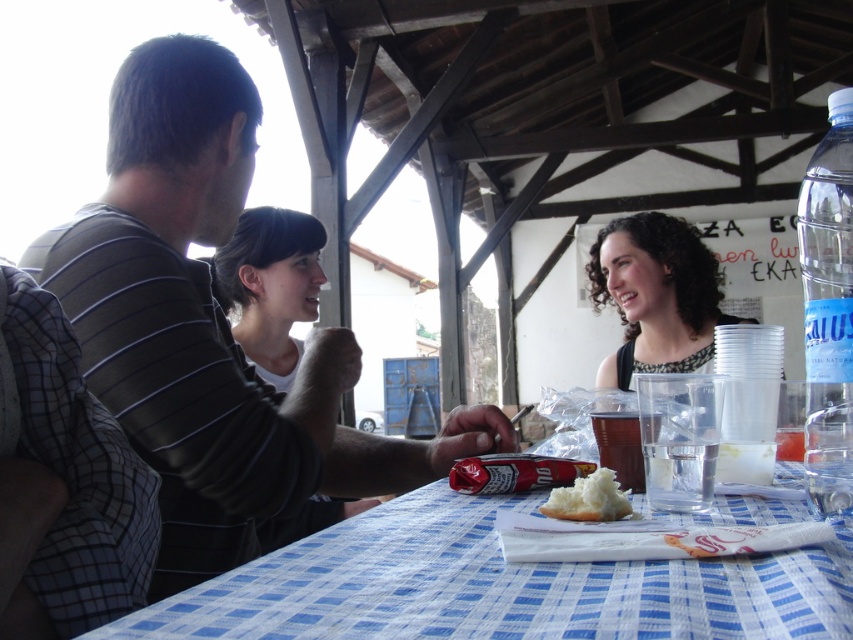
Question: Does blue checkered tablecloth at center appear over black textured shirt at center?

Choices:
 (A) no
 (B) yes

Answer: (A)

Question: Where is blue checkered tablecloth at center located in relation to matte black hair at center in the image?

Choices:
 (A) right
 (B) left

Answer: (A)

Question: Can you confirm if blue checkered tablecloth at center is positioned to the left of matte black hair at center?

Choices:
 (A) yes
 (B) no

Answer: (B)

Question: Which object appears closest to the camera in this image?

Choices:
 (A) black textured shirt at center
 (B) translucent plastic cup at table center

Answer: (B)

Question: Which object is farther from the camera taking this photo?

Choices:
 (A) clear glass water at table center
 (B) blue checkered tablecloth at center

Answer: (A)

Question: Based on their relative distances, which object is nearer to the striped cotton shirt at left?

Choices:
 (A) translucent plastic cup at table center
 (B) matte black hair at center
 (C) blue checkered tablecloth at center
 (D) white fluffy bread at center

Answer: (C)